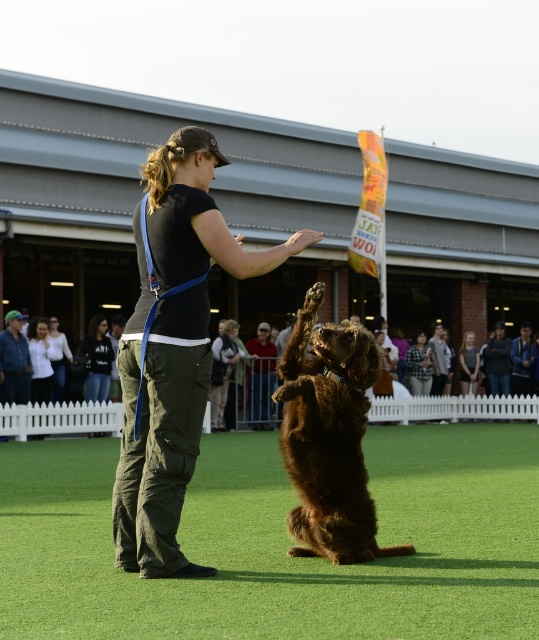
Question: Can you confirm if brown furry dog at center is smaller than white shirt at center?

Choices:
 (A) yes
 (B) no

Answer: (B)

Question: Is white shirt at center positioned behind white cotton shirt at center?

Choices:
 (A) no
 (B) yes

Answer: (A)

Question: Is brown furry dog at center closer to the viewer compared to white shirt at center?

Choices:
 (A) yes
 (B) no

Answer: (A)

Question: Which object is closer to the camera taking this photo?

Choices:
 (A) white cotton shirt at center
 (B) white shirt at center
 (C) dark gray fabric shirt at center
 (D) brown furry dog at center

Answer: (D)

Question: Among these objects, which one is farthest from the camera?

Choices:
 (A) white cotton shirt at center
 (B) black cotton shirt at center
 (C) dark gray fabric shirt at center

Answer: (C)

Question: Which of these objects is positioned farthest from the white cotton shirt at center?

Choices:
 (A) brown furry dog at center
 (B) dark gray fabric shirt at center
 (C) white shirt at center
 (D) black cotton shirt at center

Answer: (D)